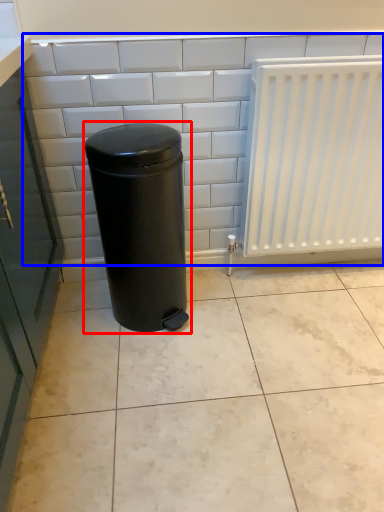
Question: Which object is further to the camera taking this photo, waste container (highlighted by a red box) or ceramic tile (highlighted by a blue box)?

Choices:
 (A) waste container
 (B) ceramic tile

Answer: (B)